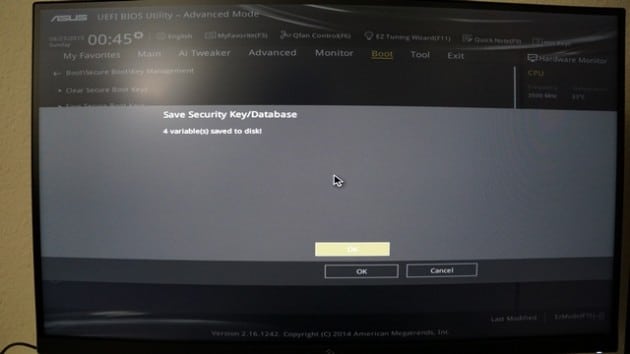
Where is `screen`? The image size is (630, 354). screen is located at coordinates (353, 138).